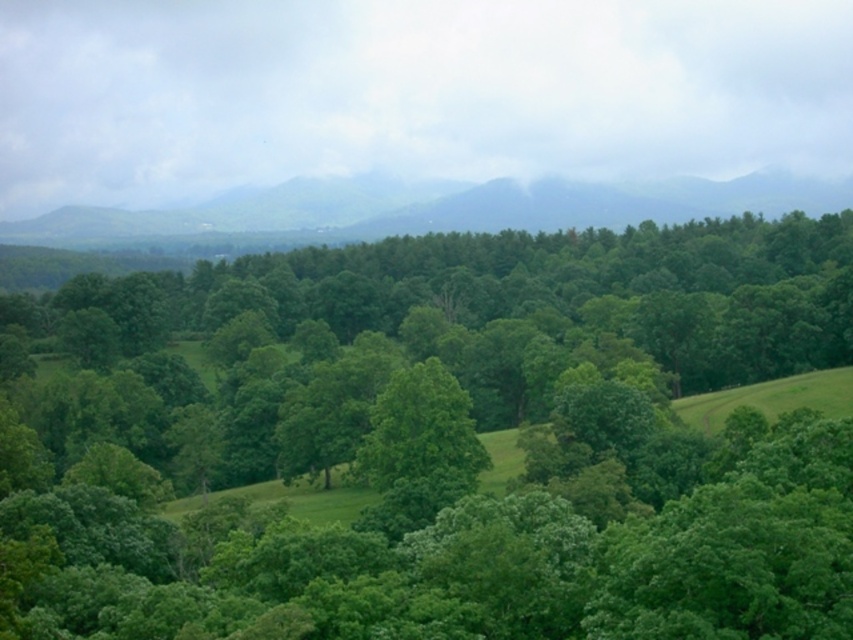
Question: Does green leafy forest at center appear on the left side of green matte mountain at upper center?

Choices:
 (A) no
 (B) yes

Answer: (B)

Question: Which of the following is the closest to the observer?

Choices:
 (A) (585, 545)
 (B) (415, 198)

Answer: (A)

Question: Which object is farther from the camera taking this photo?

Choices:
 (A) green leafy forest at center
 (B) green matte mountain at upper center

Answer: (B)

Question: Which point is closer to the camera?

Choices:
 (A) (155, 548)
 (B) (670, 212)

Answer: (A)

Question: Is green leafy forest at center to the right of green matte mountain at upper center from the viewer's perspective?

Choices:
 (A) yes
 (B) no

Answer: (B)

Question: Can you confirm if green leafy forest at center is bigger than green matte mountain at upper center?

Choices:
 (A) no
 (B) yes

Answer: (B)